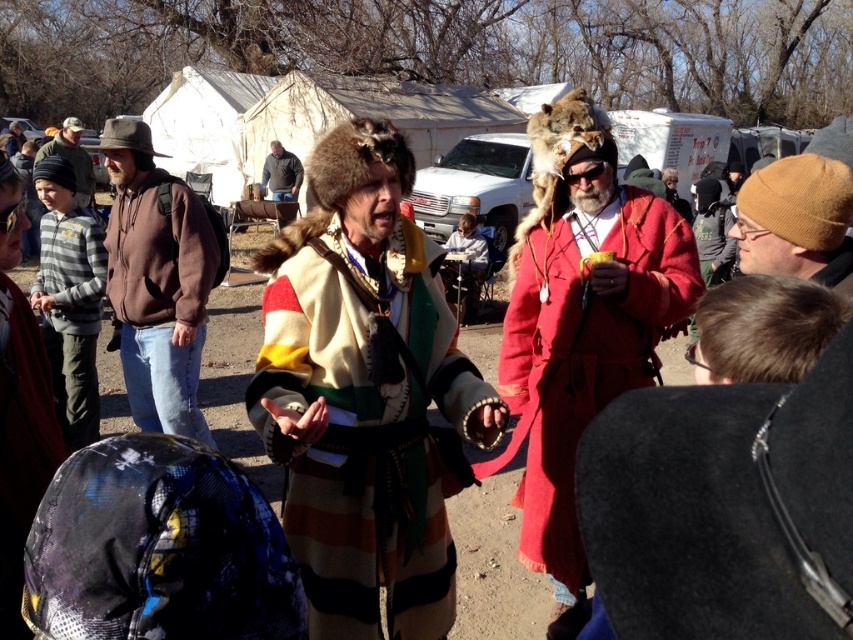
Question: Does striped woolen coat at center have a smaller size compared to fur hat at center?

Choices:
 (A) no
 (B) yes

Answer: (B)

Question: Which object is farther from the camera taking this photo?

Choices:
 (A) knitted wool beanie at left
 (B) brown fleece jacket at left
 (C) brown woolen beanie at upper right
 (D) gray striped sweater at left

Answer: (A)

Question: Does fur hat at center appear on the right side of dark gray hoodie at center?

Choices:
 (A) yes
 (B) no

Answer: (A)

Question: Is red woolen coat at center below brown woolen beanie at upper right?

Choices:
 (A) no
 (B) yes

Answer: (B)

Question: Estimate the real-world distances between objects in this image. Which object is farther from the striped woolen coat at center?

Choices:
 (A) dark gray hoodie at center
 (B) red woolen coat at center

Answer: (A)

Question: Which point is farther to the camera?

Choices:
 (A) red woolen coat at center
 (B) striped woolen coat at center
 (C) brown woolen beanie at upper right
 (D) knitted wool beanie at left

Answer: (D)